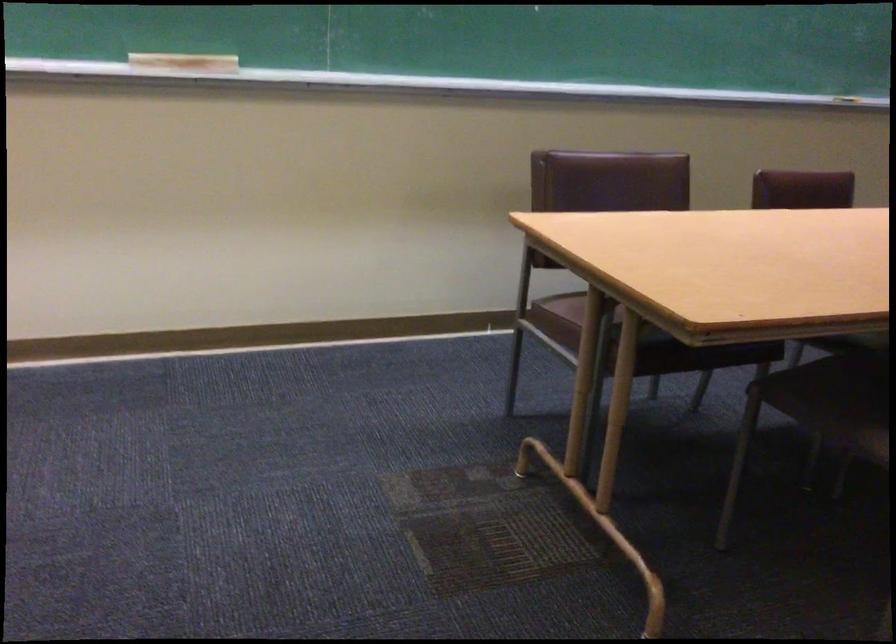
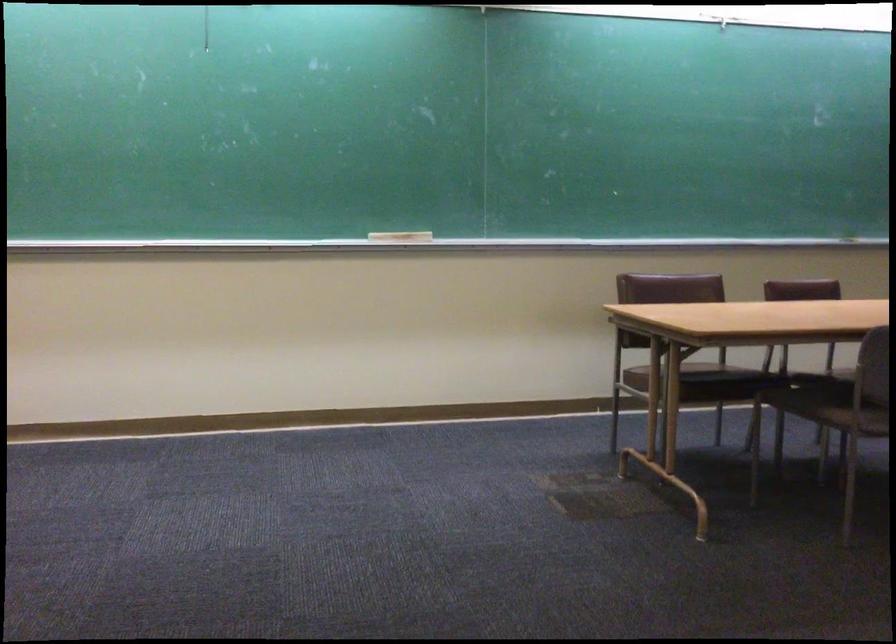
Question: Which direction would the cameraman need to move to produce the second image? Reply with the corresponding letter.

Choices:
 (A) Left
 (B) Right
 (C) Forward
 (D) Backward

Answer: (D)